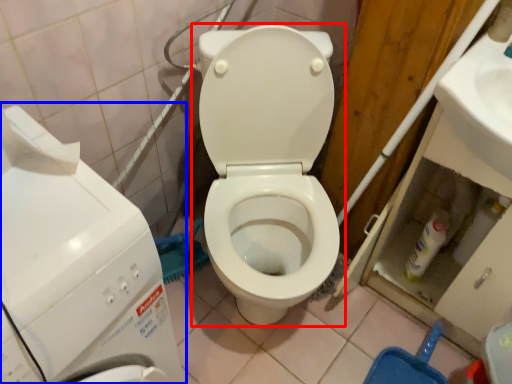
Question: Which point is closer to the camera, toilet (highlighted by a red box) or washing machine (highlighted by a blue box)?

Choices:
 (A) toilet
 (B) washing machine

Answer: (B)